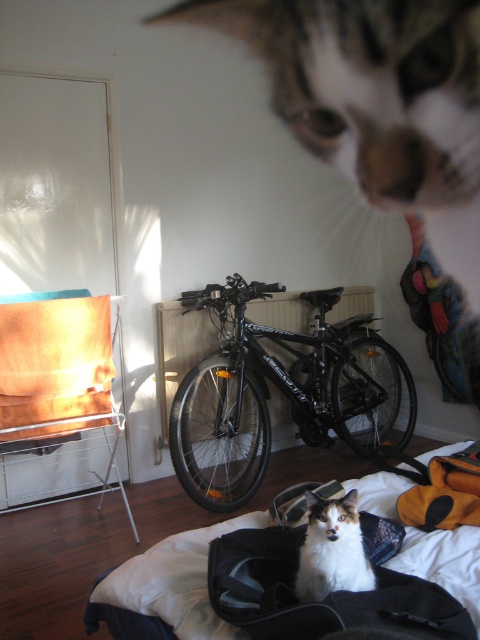
Can you confirm if soft black fabric bag at lower center is wider than calico fur cat at center?

Yes.

Measure the distance from soft black fabric bag at lower center to calico fur cat at center.

9.28 centimeters

What do you see at coordinates (327, 595) in the screenshot? The height and width of the screenshot is (640, 480). I see `soft black fabric bag at lower center` at bounding box center [327, 595].

Locate an element on the screen. The image size is (480, 640). soft black fabric bag at lower center is located at coordinates (327, 595).

Is white soft bed at center to the left of calico fur cat at center from the viewer's perspective?

No, white soft bed at center is not to the left of calico fur cat at center.

Who is more forward, (x=162, y=556) or (x=330, y=573)?

Point (x=330, y=573)

Find the location of a particular element. This screenshot has height=640, width=480. white soft bed at center is located at coordinates (175, 580).

Is black matte bicycle at center taller than soft black fabric bag at lower center?

Yes, black matte bicycle at center is taller than soft black fabric bag at lower center.

Is point (175, 445) less distant than point (456, 621)?

No, it is behind (456, 621).

Between point (348, 323) and point (280, 600), which one is positioned in front?

Positioned in front is point (280, 600).

Find the location of `black matte bicycle at center`. black matte bicycle at center is located at coordinates (284, 394).